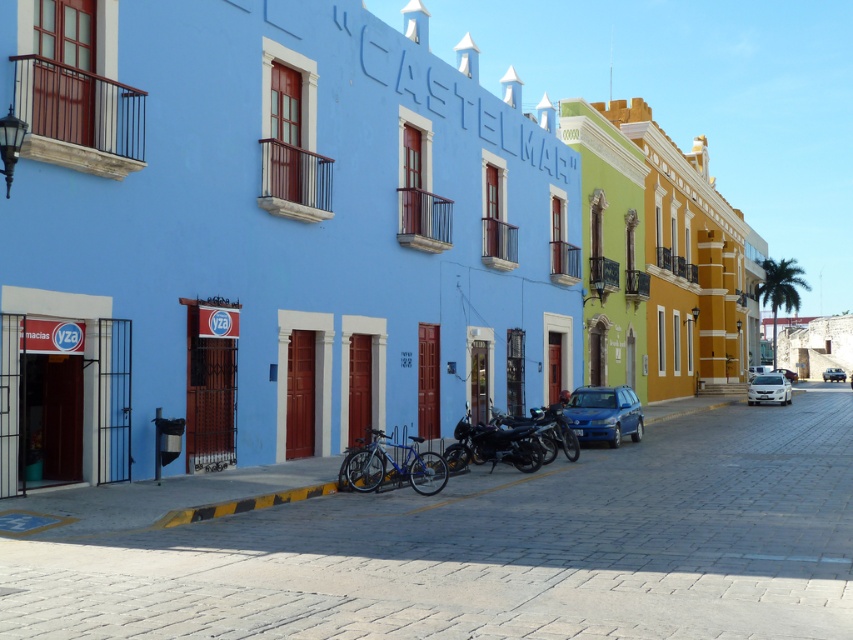
Question: Considering the relative positions of matte blue car at center and metallic silver car at right in the image provided, where is matte blue car at center located with respect to metallic silver car at right?

Choices:
 (A) below
 (B) above

Answer: (B)

Question: Does white glossy car at lower right have a lesser width compared to metallic silver car at center?

Choices:
 (A) yes
 (B) no

Answer: (A)

Question: Which object appears closest to the camera in this image?

Choices:
 (A) shiny blue bicycle at center
 (B) white glossy car at lower right
 (C) metallic silver car at right
 (D) shiny blue sedan at center

Answer: (A)

Question: Among these objects, which one is farthest from the camera?

Choices:
 (A) white glossy car at lower right
 (B) shiny blue sedan at center

Answer: (B)

Question: Based on their relative distances, which object is nearer to the metallic silver car at center?

Choices:
 (A) shiny blue bicycle at center
 (B) metallic silver car at right
 (C) matte blue car at center

Answer: (B)

Question: Does shiny blue bicycle at center appear over metallic silver car at right?

Choices:
 (A) yes
 (B) no

Answer: (A)